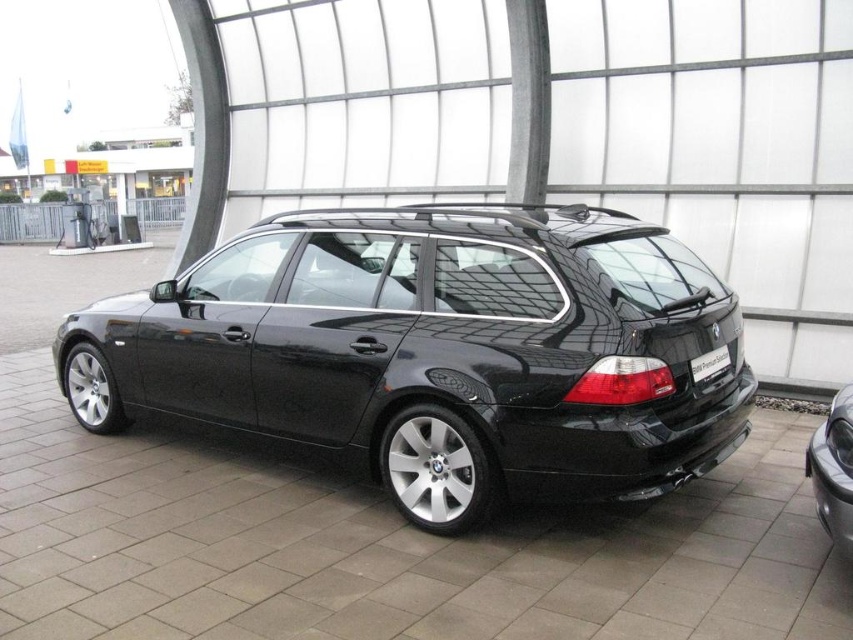
You are a photographer trying to capture the glossy black car at center and the black plastic license plate at rear in a single shot. Since the camera can only focus on one object at a time, which object should you focus on to ensure it appears larger in the photo?

The glossy black car at center is larger in size than the black plastic license plate at rear, so focusing on the glossy black car at center will ensure it appears larger in the photo.

You are a photographer setting up equipment in a car showroom. You need to position two tripods between the glossy black car at center and the satin black car at lower right. Considering their widths, which car requires a wider space between them for the tripods?

The glossy black car at center requires a wider space between them for the tripods because its width surpasses that of the satin black car at lower right.

In the scene shown: You are standing in front of the glossy black car at center and want to locate the black plastic license plate at rear. In which direction should you look relative to the car?

The glossy black car at center is to the left of the black plastic license plate at rear, so you should look to the right side of the car to find the black plastic license plate at rear.